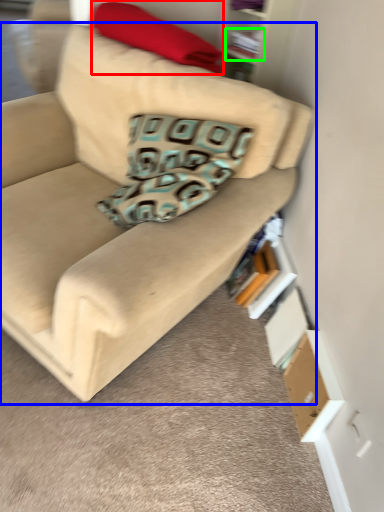
Question: Which object is the farthest from blanket (highlighted by a red box)? Choose among these: studio couch (highlighted by a blue box) or book (highlighted by a green box).

Choices:
 (A) studio couch
 (B) book

Answer: (A)